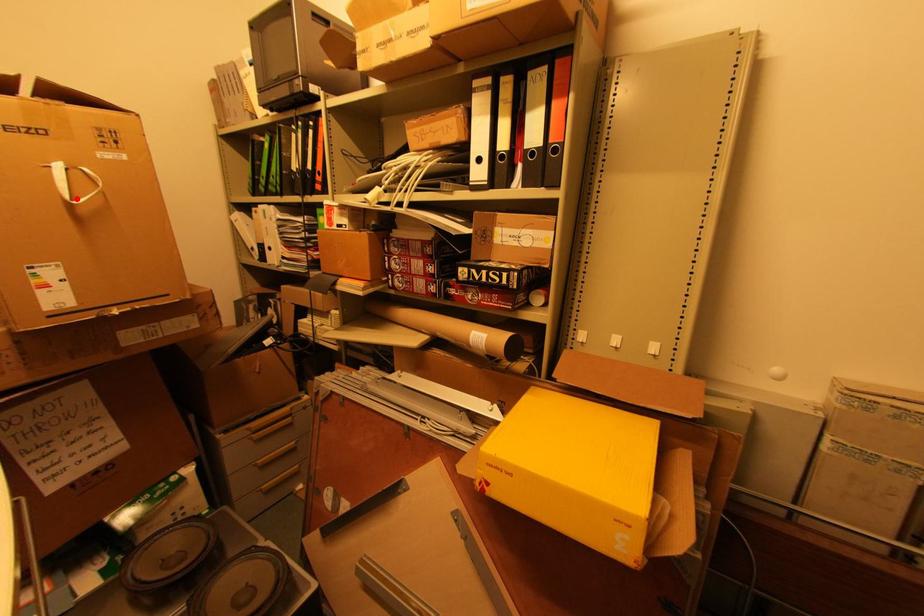
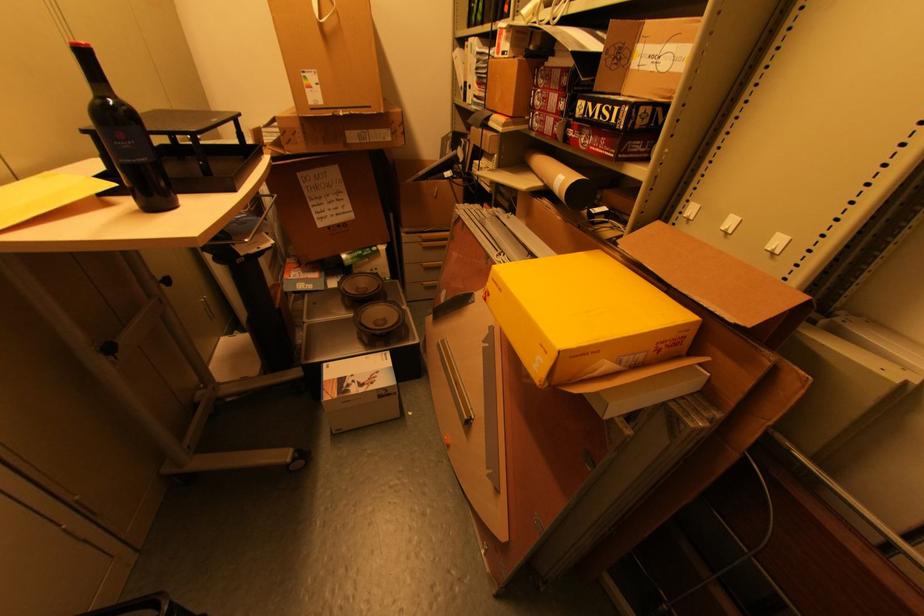
Find the pixel in the second image that matches the highlighted location in the first image.

(323, 18)